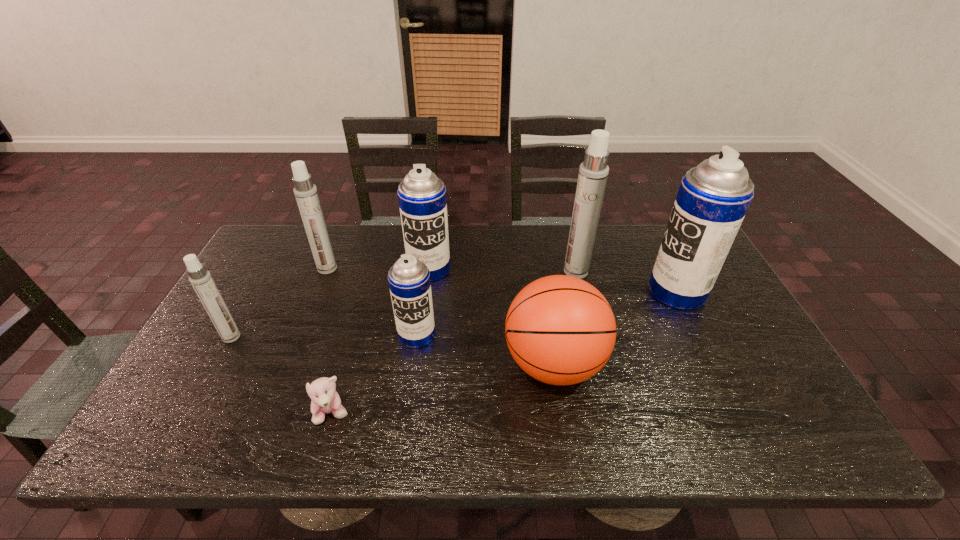
Locate an element on the screen. basketball is located at coordinates (560, 330).

Find the location of a particular element. The height and width of the screenshot is (540, 960). the third object from left to right is located at coordinates (325, 400).

This screenshot has width=960, height=540. I want to click on pink teddy bear, so click(x=325, y=400).

I want to click on free region located 0.080m on the left of the biggest white aerosol can, so click(539, 272).

Locate an element on the screen. The width and height of the screenshot is (960, 540). free space located 0.400m on the label side of the rightmost object is located at coordinates (515, 291).

At what (x,y) coordinates should I click in order to perform the action: click on vacant space situated on the label side of the rightmost object. Please return your answer as a coordinate pair (x, y). This screenshot has height=540, width=960. Looking at the image, I should click on (541, 291).

Identify the location of vacant space located on the label side of the rightmost object. (535, 291).

In order to click on vacant area situated 0.060m on the left of the second white aerosol can from left to right in this screenshot , I will do `click(299, 268)`.

Identify the location of free space located on the label side of the second biggest blue aerosol can. The width and height of the screenshot is (960, 540). (420, 341).

Where is `free space located on the back of the nearest white aerosol can`? The image size is (960, 540). free space located on the back of the nearest white aerosol can is located at coordinates (247, 309).